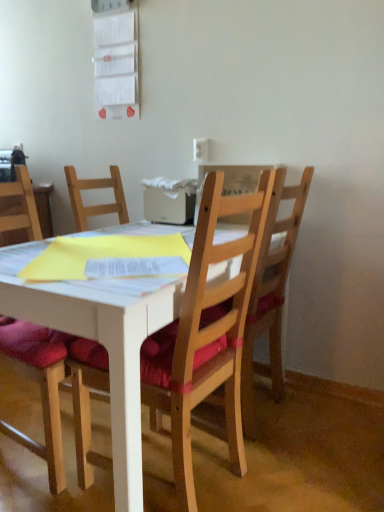
Question: Can we say wooden chair at center, the 2th chair from the left, lies outside wooden chair at right, the 1th chair in the right-to-left sequence?

Choices:
 (A) no
 (B) yes

Answer: (B)

Question: Is wooden chair at center, the 2th chair positioned from the right, positioned with its back to wooden chair at right, the 1th chair in the right-to-left sequence?

Choices:
 (A) yes
 (B) no

Answer: (B)

Question: Can you confirm if wooden chair at center, the 2th chair from the left, is smaller than wooden chair at right, the 1th chair in the right-to-left sequence?

Choices:
 (A) yes
 (B) no

Answer: (B)

Question: Does wooden chair at center, the 2th chair positioned from the right, appear on the left side of wooden chair at right, the 1th chair in the right-to-left sequence?

Choices:
 (A) yes
 (B) no

Answer: (A)

Question: From the image's perspective, is wooden chair at center, the 2th chair from the left, located beneath wooden chair at right, the 1th chair in the right-to-left sequence?

Choices:
 (A) no
 (B) yes

Answer: (B)

Question: From a real-world perspective, is wooden chair at center, the 2th chair from the left, under wooden chair at right, placed as the third chair when sorted from left to right?

Choices:
 (A) yes
 (B) no

Answer: (A)

Question: Is wooden chair with red cushion at left, placed as the 1th chair when sorted from left to right, to the left of wooden chair at center, the 2th chair positioned from the right, from the viewer's perspective?

Choices:
 (A) no
 (B) yes

Answer: (B)

Question: Is wooden chair with red cushion at left, the 3th chair viewed from the right, placed right next to wooden chair at center, the 2th chair from the left?

Choices:
 (A) yes
 (B) no

Answer: (B)

Question: Are wooden chair with red cushion at left, the 3th chair viewed from the right, and wooden chair at center, the 2th chair positioned from the right, far apart?

Choices:
 (A) no
 (B) yes

Answer: (A)

Question: From the image's perspective, does wooden chair with red cushion at left, the 3th chair viewed from the right, appear lower than wooden chair at center, the 2th chair positioned from the right?

Choices:
 (A) no
 (B) yes

Answer: (A)

Question: Considering the relative sizes of wooden chair with red cushion at left, the 3th chair viewed from the right, and wooden chair at center, the 2th chair positioned from the right, in the image provided, is wooden chair with red cushion at left, the 3th chair viewed from the right, bigger than wooden chair at center, the 2th chair positioned from the right,?

Choices:
 (A) no
 (B) yes

Answer: (A)

Question: From a real-world perspective, is wooden chair with red cushion at left, placed as the 1th chair when sorted from left to right, positioned under wooden chair at center, the 2th chair from the left, based on gravity?

Choices:
 (A) no
 (B) yes

Answer: (A)

Question: Does wooden chair at right, placed as the third chair when sorted from left to right, have a lesser height compared to white plastic power outlet at upper center?

Choices:
 (A) no
 (B) yes

Answer: (A)